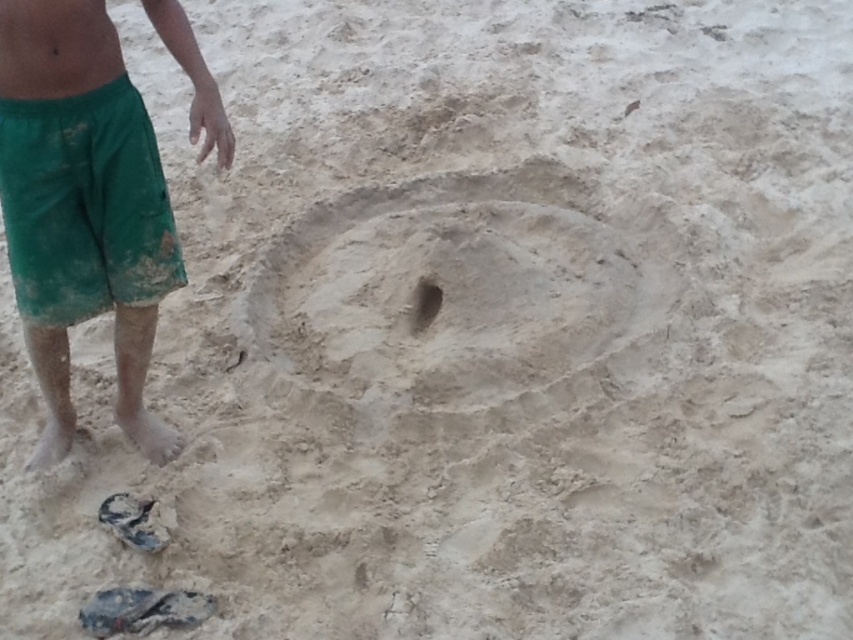
Consider the image. You are a lifeguard on duty and see the skinny bare torso at upper left and the smooth sand hole at center. Which object is positioned higher in the image?

The skinny bare torso at upper left is positioned higher in the image than the smooth sand hole at center.

You are a photographer trying to capture the two points in the scene. Which point, point (44, 330) or point (412, 298), will appear larger in your photo?

Point (44, 330) is closer to the camera than point (412, 298), so it will appear larger in the photo.

Based on the scene description, can the skinny bare torso at upper left fit into the smooth sand hole at center?

The skinny bare torso at upper left might be wider than smooth sand hole at center, so it may not fit properly.